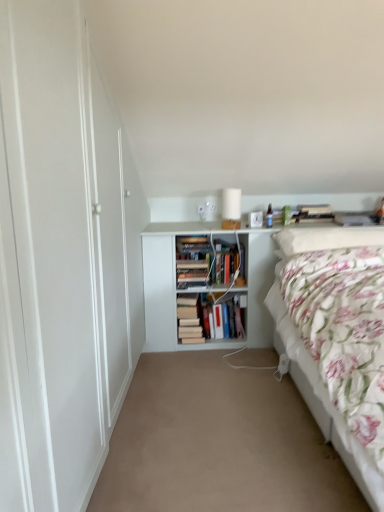
Question: From a real-world perspective, is fluffy white pillow at upper right positioned under beige carpet at center based on gravity?

Choices:
 (A) yes
 (B) no

Answer: (B)

Question: Is fluffy white pillow at upper right closer to camera compared to beige carpet at center?

Choices:
 (A) yes
 (B) no

Answer: (B)

Question: Can you confirm if fluffy white pillow at upper right is smaller than beige carpet at center?

Choices:
 (A) yes
 (B) no

Answer: (A)

Question: Is fluffy white pillow at upper right bigger than beige carpet at center?

Choices:
 (A) yes
 (B) no

Answer: (B)

Question: Is fluffy white pillow at upper right at the left side of beige carpet at center?

Choices:
 (A) no
 (B) yes

Answer: (A)

Question: From the image's perspective, is white matte bookshelf at center located above or below beige carpet at center?

Choices:
 (A) above
 (B) below

Answer: (A)

Question: Considering the positions of white matte bookshelf at center and beige carpet at center in the image, is white matte bookshelf at center wider or thinner than beige carpet at center?

Choices:
 (A) wide
 (B) thin

Answer: (B)

Question: Considering the relative positions of white matte bookshelf at center and beige carpet at center in the image provided, is white matte bookshelf at center to the left or to the right of beige carpet at center?

Choices:
 (A) left
 (B) right

Answer: (B)

Question: Considering their positions, is white matte bookshelf at center located in front of or behind beige carpet at center?

Choices:
 (A) front
 (B) behind

Answer: (B)

Question: In terms of size, does hardcover book at center, the first book positioned from the right, appear bigger or smaller than white matte bookshelf at center?

Choices:
 (A) big
 (B) small

Answer: (B)

Question: Is point (210, 328) closer or farther from the camera than point (251, 268)?

Choices:
 (A) closer
 (B) farther

Answer: (B)

Question: Considering the positions of hardcover book at center, arranged as the 2th book when viewed from the left, and white matte bookshelf at center in the image, is hardcover book at center, arranged as the 2th book when viewed from the left, taller or shorter than white matte bookshelf at center?

Choices:
 (A) short
 (B) tall

Answer: (A)

Question: Is hardcover book at center, the first book positioned from the right, wider or thinner than white matte bookshelf at center?

Choices:
 (A) wide
 (B) thin

Answer: (B)

Question: Is point [x=193, y=336] closer or farther from the camera than point [x=190, y=321]?

Choices:
 (A) farther
 (B) closer

Answer: (A)

Question: Looking at the image, does hardcover books at center, the 2th book viewed from the right, seem bigger or smaller compared to hardcover book at center, the first book positioned from the right?

Choices:
 (A) small
 (B) big

Answer: (A)